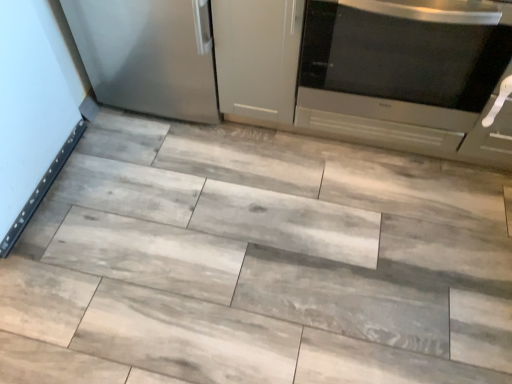
You are a GUI agent. You are given a task and a screenshot of the screen. Output one action in this format:
    pyautogui.click(x=<x>, y=<y>)
    Task: Click on the satin silver microwave at right
    
    Given the screenshot: What is the action you would take?
    pyautogui.click(x=403, y=59)

What do you see at coordinates (257, 263) in the screenshot? I see `gray wood tile at center` at bounding box center [257, 263].

What do you see at coordinates (148, 55) in the screenshot? This screenshot has width=512, height=384. I see `satin metallic refrigerator at left` at bounding box center [148, 55].

What is the approximate height of satin metallic refrigerator at left?

The height of satin metallic refrigerator at left is 22.94 inches.

Locate an element on the screen. satin silver microwave at right is located at coordinates (403, 59).

Measure the distance from satin silver microwave at right to satin metallic refrigerator at left.

A distance of 23.28 inches exists between satin silver microwave at right and satin metallic refrigerator at left.

From a real-world perspective, is satin silver microwave at right physically located above or below satin metallic refrigerator at left?

From a real-world perspective, satin silver microwave at right is physically above satin metallic refrigerator at left.

Relative to satin metallic refrigerator at left, is satin silver microwave at right in front or behind?

In the image, satin silver microwave at right appears in front of satin metallic refrigerator at left.

Who is shorter, satin silver microwave at right or satin metallic refrigerator at left?

satin metallic refrigerator at left.

From the image's perspective, between satin metallic refrigerator at left and gray wood tile at center, who is located below?

gray wood tile at center appears lower in the image.

Which of these two, satin metallic refrigerator at left or gray wood tile at center, is smaller?

gray wood tile at center is smaller.

Image resolution: width=512 pixels, height=384 pixels. What are the coordinates of `ceramic tile below the satin metallic refrigerator at left (from a real-world perspective)` in the screenshot? It's located at (257, 263).

Could satin silver microwave at right be considered to be inside satin metallic refrigerator at left?

Definitely not — satin silver microwave at right is not inside satin metallic refrigerator at left.

From the image's perspective, is satin metallic refrigerator at left on satin silver microwave at right?

Yes, from the image's perspective, satin metallic refrigerator at left is over satin silver microwave at right.

Between satin metallic refrigerator at left and satin silver microwave at right, which one has smaller size?

satin metallic refrigerator at left is smaller.

Based on the photo, how different are the orientations of satin metallic refrigerator at left and satin silver microwave at right in degrees?

0.648 degrees separate the facing orientations of satin metallic refrigerator at left and satin silver microwave at right.

From the image's perspective, would you say gray wood tile at center is positioned over satin metallic refrigerator at left?

No, from the image's perspective, gray wood tile at center is not above satin metallic refrigerator at left.

Considering the positions of objects gray wood tile at center and satin metallic refrigerator at left in the image provided, who is more to the right, gray wood tile at center or satin metallic refrigerator at left?

Positioned to the right is gray wood tile at center.

From a real-world perspective, which object rests below the other?

gray wood tile at center, from a real-world perspective.

Does gray wood tile at center appear on the right side of satin silver microwave at right?

Incorrect, gray wood tile at center is not on the right side of satin silver microwave at right.

Is gray wood tile at center positioned far away from satin silver microwave at right?

gray wood tile at center is actually quite close to satin silver microwave at right.

In the scene shown: From the image's perspective, is gray wood tile at center located above or below satin silver microwave at right?

Based on their image positions, gray wood tile at center is located beneath satin silver microwave at right.

Looking at this image, considering the sizes of objects gray wood tile at center and satin silver microwave at right in the image provided, who is thinner, gray wood tile at center or satin silver microwave at right?

satin silver microwave at right is thinner.

Is satin silver microwave at right far from gray wood tile at center?

No, satin silver microwave at right is not far away from gray wood tile at center.

Could you tell me if satin silver microwave at right is facing gray wood tile at center?

Yes.

From the image's perspective, is satin silver microwave at right beneath gray wood tile at center?

No, from the image's perspective, satin silver microwave at right is not below gray wood tile at center.

Where is `appliance below the satin silver microwave at right (from a real-world perspective)`? The width and height of the screenshot is (512, 384). appliance below the satin silver microwave at right (from a real-world perspective) is located at coordinates (148, 55).

Identify the location of appliance on the left of gray wood tile at center. (148, 55).

Based on their spatial positions, is satin metallic refrigerator at left or satin silver microwave at right further from gray wood tile at center?

Based on the image, satin metallic refrigerator at left appears to be further to gray wood tile at center.

When comparing their distances from satin silver microwave at right, does satin metallic refrigerator at left or gray wood tile at center seem closer?

Based on the image, gray wood tile at center appears to be nearer to satin silver microwave at right.

Which object lies further to the anchor point satin silver microwave at right, gray wood tile at center or satin metallic refrigerator at left?

satin metallic refrigerator at left lies further to satin silver microwave at right than the other object.

Which object lies nearer to the anchor point satin metallic refrigerator at left, gray wood tile at center or satin silver microwave at right?

gray wood tile at center is positioned closer to the anchor satin metallic refrigerator at left.

Estimate the real-world distances between objects in this image. Which object is further from gray wood tile at center, satin silver microwave at right or satin metallic refrigerator at left?

satin metallic refrigerator at left is further to gray wood tile at center.

When comparing their distances from satin metallic refrigerator at left, does satin silver microwave at right or gray wood tile at center seem closer?

The object closer to satin metallic refrigerator at left is gray wood tile at center.

Where is `home appliance between satin metallic refrigerator at left and gray wood tile at center from top to bottom`? home appliance between satin metallic refrigerator at left and gray wood tile at center from top to bottom is located at coordinates [x=403, y=59].